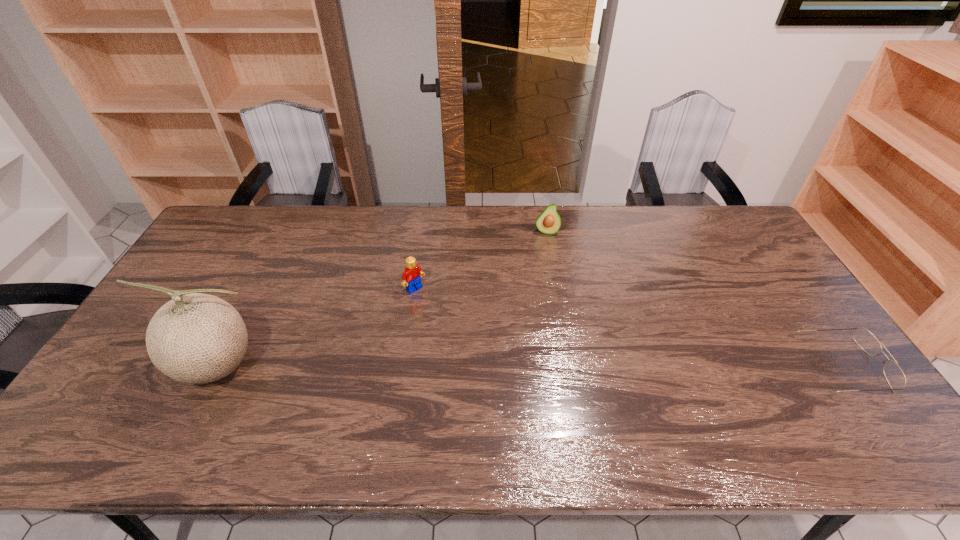
This screenshot has height=540, width=960. In order to click on object located at the near left corner in this screenshot , I will do `click(197, 338)`.

Find the location of a particular element. The width and height of the screenshot is (960, 540). object located in the near right corner section of the desktop is located at coordinates (895, 377).

In the image, there is a desktop. Identify the location of free space at the far edge. The height and width of the screenshot is (540, 960). (516, 224).

At what (x,y) coordinates should I click in order to perform the action: click on vacant space at the near edge of the desktop. Please return your answer as a coordinate pair (x, y). Looking at the image, I should click on (518, 382).

This screenshot has height=540, width=960. In order to click on free space at the left edge of the desktop in this screenshot , I will do `click(195, 268)`.

In the image, there is a desktop. Where is `vacant space at the right edge`? The image size is (960, 540). vacant space at the right edge is located at coordinates (804, 318).

In order to click on vacant area between the rightmost object and the avocado in this screenshot , I will do `click(695, 299)`.

Locate an element on the screen. free space between the avocado and the shortest object is located at coordinates (695, 299).

The width and height of the screenshot is (960, 540). I want to click on vacant space in between the rightmost object and the tallest object, so click(x=529, y=366).

The height and width of the screenshot is (540, 960). Find the location of `free space between the Lego and the shortest object`. free space between the Lego and the shortest object is located at coordinates (629, 327).